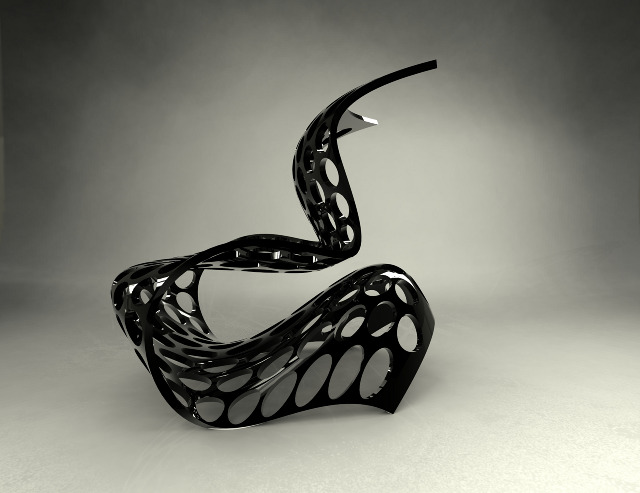
I want to click on backdrop, so click(x=467, y=160).